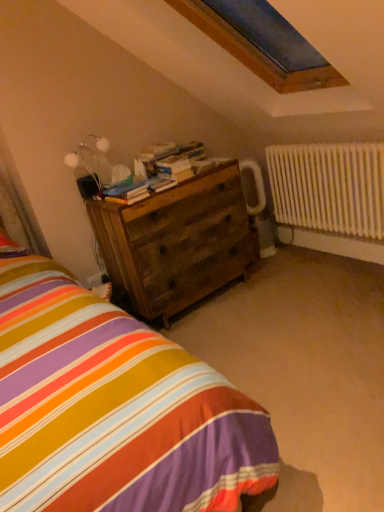
Image resolution: width=384 pixels, height=512 pixels. I want to click on white painted metal radiator at right, so click(329, 187).

Identify the location of wooden books at center, which is the 1th book from front to back. This screenshot has height=512, width=384. (128, 191).

This screenshot has height=512, width=384. I want to click on striped fabric bed at lower left, so click(x=114, y=408).

The height and width of the screenshot is (512, 384). What do you see at coordinates (114, 408) in the screenshot?
I see `striped fabric bed at lower left` at bounding box center [114, 408].

At what (x,y) coordinates should I click in order to perform the action: click on wooden chest of drawers at center. Please return your answer as a coordinate pair (x, y). Image resolution: width=384 pixels, height=512 pixels. Looking at the image, I should click on (177, 242).

Is wooden chest of drawers at center far away from metallic silver table lamp at upper left?

Actually, wooden chest of drawers at center and metallic silver table lamp at upper left are a little close together.

From the image's perspective, which is above, wooden chest of drawers at center or metallic silver table lamp at upper left?

From the image's view, metallic silver table lamp at upper left is above.

Which object is positioned more to the left, wooden chest of drawers at center or metallic silver table lamp at upper left?

Positioned to the left is metallic silver table lamp at upper left.

Between point (137, 215) and point (72, 152), which one is positioned behind?

The point (72, 152) is farther from the camera.

In the scene shown: Is wooden books at center, which appears as the 2th book when viewed from the top, far away from wooden chest of drawers at center?

No, there isn't a large distance between wooden books at center, which appears as the 2th book when viewed from the top, and wooden chest of drawers at center.

Would you say wooden chest of drawers at center is part of wooden books at center, which is the 1th book from front to back,'s contents?

No, wooden books at center, which is the 1th book from front to back, does not contain wooden chest of drawers at center.

Looking at this image, considering the sizes of wooden books at center, the 1th book positioned from the bottom, and wooden chest of drawers at center in the image, is wooden books at center, the 1th book positioned from the bottom, wider or thinner than wooden chest of drawers at center?

Clearly, wooden books at center, the 1th book positioned from the bottom, has less width compared to wooden chest of drawers at center.

In terms of size, does wooden books at center, which ranks as the second book in back-to-front order, appear bigger or smaller than wooden chest of drawers at center?

In the image, wooden books at center, which ranks as the second book in back-to-front order, appears to be smaller than wooden chest of drawers at center.

Visually, is wooden books at center, the 1th book viewed from the back, positioned to the left or to the right of striped fabric bed at lower left?

wooden books at center, the 1th book viewed from the back, is to the left of striped fabric bed at lower left.

Is wooden books at center, placed as the 2th book when sorted from front to back, far away from striped fabric bed at lower left?

Yes, wooden books at center, placed as the 2th book when sorted from front to back, and striped fabric bed at lower left are located far from each other.

Considering the positions of points (174, 149) and (111, 421), is point (174, 149) farther from camera compared to point (111, 421)?

Yes, point (174, 149) is farther from viewer.

From a real-world perspective, between wooden books at center, the 1th book viewed from the back, and striped fabric bed at lower left, who is vertically higher?

From a 3D spatial view, wooden books at center, the 1th book viewed from the back, is above.

Who is shorter, wooden books at center, the 1th book positioned from the bottom, or white painted metal radiator at right?

wooden books at center, the 1th book positioned from the bottom, is shorter.

Is wooden books at center, which ranks as the second book in back-to-front order, far from white painted metal radiator at right?

Absolutely, wooden books at center, which ranks as the second book in back-to-front order, is distant from white painted metal radiator at right.

From a real-world perspective, which is physically below, wooden books at center, which is the 1th book from front to back, or white painted metal radiator at right?

From a 3D spatial view, white painted metal radiator at right is below.

Does point (114, 193) come closer to viewer compared to point (343, 206)?

Yes, it is.

Image resolution: width=384 pixels, height=512 pixels. What are the coordinates of `the chest of drawers located in front of the wooden books at center, the 2th book positioned from the bottom` in the screenshot? It's located at (177, 242).

Considering the relative sizes of wooden books at center, the 2th book positioned from the bottom, and wooden chest of drawers at center in the image provided, is wooden books at center, the 2th book positioned from the bottom, taller than wooden chest of drawers at center?

Incorrect, the height of wooden books at center, the 2th book positioned from the bottom, is not larger of that of wooden chest of drawers at center.

From a real-world perspective, who is located higher, wooden books at center, the first book viewed from the top, or wooden chest of drawers at center?

wooden books at center, the first book viewed from the top, is physically above.

Is striped fabric bed at lower left not inside metallic silver table lamp at upper left?

Indeed, striped fabric bed at lower left is completely outside metallic silver table lamp at upper left.

From the picture: Measure the distance between striped fabric bed at lower left and metallic silver table lamp at upper left.

striped fabric bed at lower left and metallic silver table lamp at upper left are 1.34 meters apart.

Is point (21, 487) farther from camera compared to point (93, 173)?

No, it is not.

Which object is positioned more to the right, striped fabric bed at lower left or metallic silver table lamp at upper left?

striped fabric bed at lower left.

Would you say wooden books at center, which is the 1th book from front to back, is inside or outside striped fabric bed at lower left?

wooden books at center, which is the 1th book from front to back, is spatially situated outside striped fabric bed at lower left.

Is wooden books at center, which appears as the 2th book when viewed from the top, aimed at striped fabric bed at lower left?

No.

Does wooden books at center, the 1th book positioned from the bottom, have a smaller size compared to striped fabric bed at lower left?

Yes.

From a real-world perspective, relative to striped fabric bed at lower left, is wooden books at center, which is the 1th book from front to back, vertically above or below?

In terms of real-world spatial position, wooden books at center, which is the 1th book from front to back, is above striped fabric bed at lower left.

Find the location of a particular element. The image size is (384, 512). table lamp that appears above the wooden chest of drawers at center (from a real-world perspective) is located at coordinates (77, 156).

Where is `the chest of drawers lying below the wooden books at center, which ranks as the second book in back-to-front order (from the image's perspective)`? The width and height of the screenshot is (384, 512). the chest of drawers lying below the wooden books at center, which ranks as the second book in back-to-front order (from the image's perspective) is located at coordinates (177, 242).

From the picture: Considering their positions, is wooden chest of drawers at center positioned closer to white painted metal radiator at right than wooden books at center, the 2th book positioned from the bottom?

wooden chest of drawers at center is positioned closer to the anchor white painted metal radiator at right.

From the image, which object appears to be nearer to wooden books at center, the first book viewed from the top, striped fabric bed at lower left or white painted metal radiator at right?

The object closer to wooden books at center, the first book viewed from the top, is white painted metal radiator at right.

From the image, which object appears to be nearer to wooden books at center, which appears as the 2th book when viewed from the top, wooden chest of drawers at center or striped fabric bed at lower left?

Based on the image, wooden chest of drawers at center appears to be nearer to wooden books at center, which appears as the 2th book when viewed from the top.

When comparing their distances from wooden books at center, the first book viewed from the top, does striped fabric bed at lower left or wooden books at center, which is the 1th book from front to back, seem closer?

wooden books at center, which is the 1th book from front to back.

When comparing their distances from white painted metal radiator at right, does wooden books at center, placed as the 2th book when sorted from front to back, or wooden chest of drawers at center seem closer?

Based on the image, wooden chest of drawers at center appears to be nearer to white painted metal radiator at right.

Looking at the image, which one is located closer to wooden books at center, the first book viewed from the top, metallic silver table lamp at upper left or striped fabric bed at lower left?

Based on the image, metallic silver table lamp at upper left appears to be nearer to wooden books at center, the first book viewed from the top.

When comparing their distances from wooden books at center, the 2th book positioned from the bottom, does white painted metal radiator at right or metallic silver table lamp at upper left seem closer?

Among the two, metallic silver table lamp at upper left is located nearer to wooden books at center, the 2th book positioned from the bottom.

When comparing their distances from striped fabric bed at lower left, does wooden books at center, the 1th book viewed from the back, or white painted metal radiator at right seem closer?

Based on the image, wooden books at center, the 1th book viewed from the back, appears to be nearer to striped fabric bed at lower left.

Image resolution: width=384 pixels, height=512 pixels. I want to click on book situated between wooden books at center, which appears as the 2th book when viewed from the top, and white painted metal radiator at right from left to right, so click(x=173, y=161).

Locate an element on the screen. book between striped fabric bed at lower left and wooden chest of drawers at center along the z-axis is located at coordinates [x=128, y=191].

This screenshot has height=512, width=384. Identify the location of book that lies between wooden books at center, placed as the 2th book when sorted from front to back, and wooden chest of drawers at center from top to bottom. (128, 191).

This screenshot has width=384, height=512. Identify the location of table lamp between wooden books at center, the first book viewed from the top, and wooden chest of drawers at center from top to bottom. (77, 156).